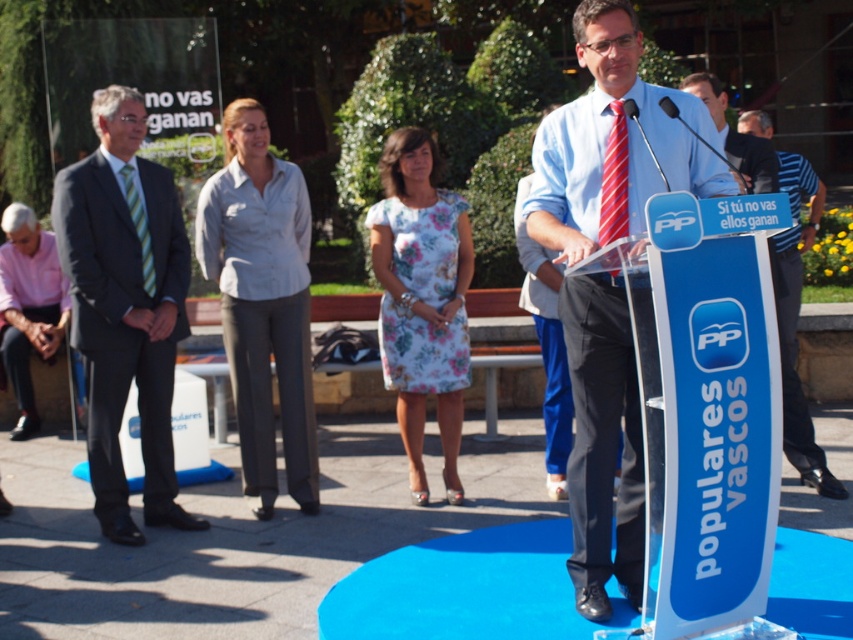
You are a photographer at the event and want to capture a closeup of the speaker. You need to focus on either the light blue cotton shirt at center or the red striped tie at center first. Which one should you focus on first to ensure proper depth of field?

The light blue cotton shirt at center is further to the viewer than the red striped tie at center, so you should focus on the light blue cotton shirt at center first to ensure proper depth of field.

You are a photographer at the event and need to ensure that both the light blue shirt at center and the green striped tie at left are visible in your photo. Given their sizes, which object will require more space in the frame?

The light blue shirt at center requires more space in the frame because its width is larger than the green striped tie at left.

What is located at the coordinates point (125, 307)?

At point (125, 307) lies dark gray suit at left.